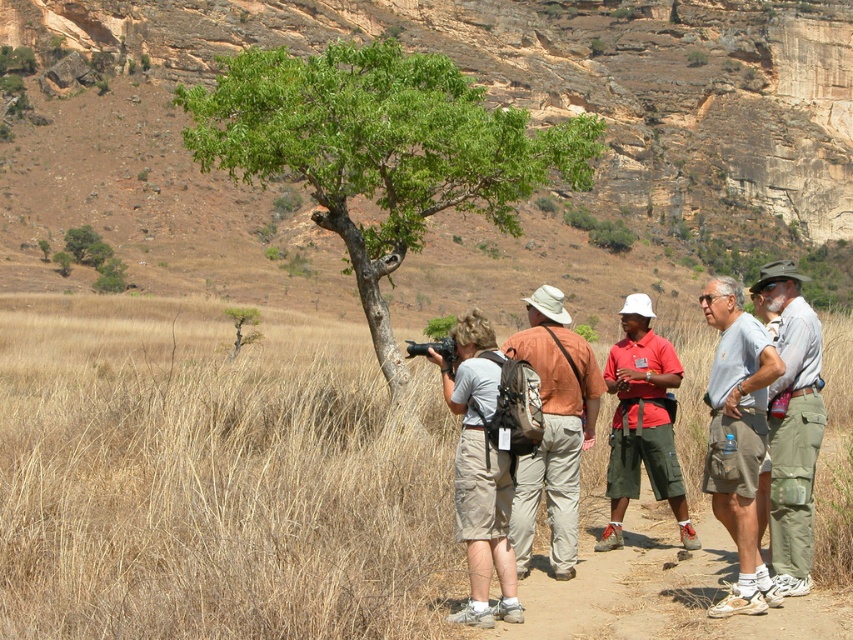
You are a photographer trying to capture a photo of the matte brown shirt at center without including the green leafy tree at center in the background. Based on their positions, is this possible?

The green leafy tree at center is located above the matte brown shirt at center, so it would be in the background of the photo. Therefore, it is not possible to capture the matte brown shirt at center without including the green leafy tree at center in the background.